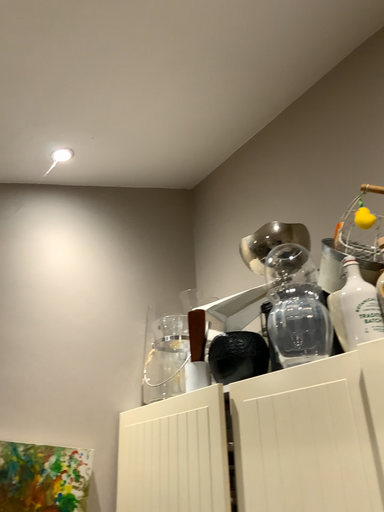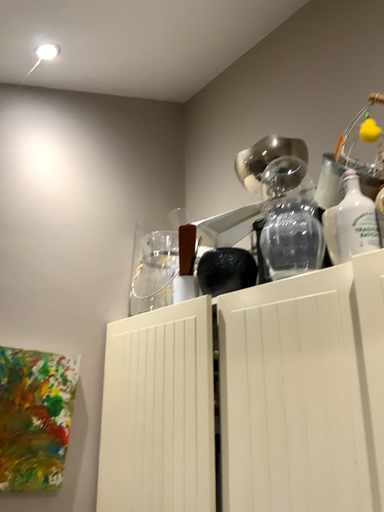
Question: How did the camera likely rotate when shooting the video?

Choices:
 (A) rotated upward
 (B) rotated downward

Answer: (B)